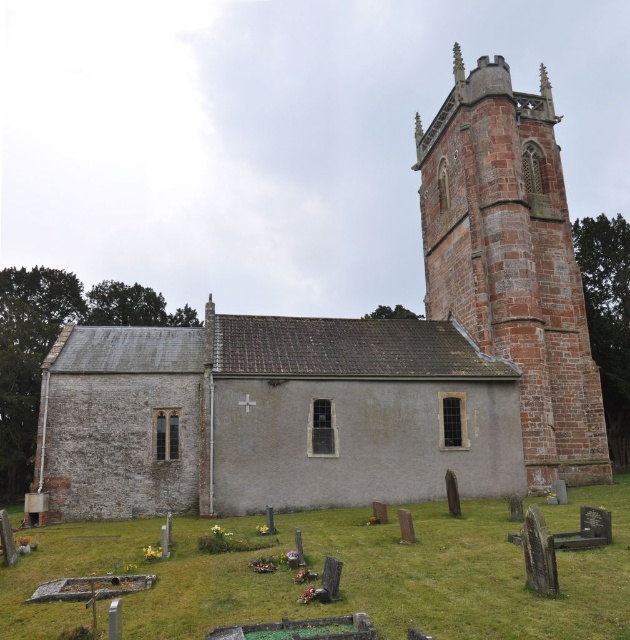
Question: Is smooth stone church at center behind rustic stone tower at right?

Choices:
 (A) no
 (B) yes

Answer: (A)

Question: Where is smooth stone church at center located in relation to rustic stone tower at right in the image?

Choices:
 (A) right
 (B) left

Answer: (B)

Question: Which point is farther to the camera?

Choices:
 (A) (553, 209)
 (B) (524, 234)

Answer: (A)

Question: Does smooth stone church at center appear under rustic stone tower at right?

Choices:
 (A) no
 (B) yes

Answer: (B)

Question: Which point appears farthest from the camera in this image?

Choices:
 (A) (524, 106)
 (B) (546, 113)

Answer: (B)